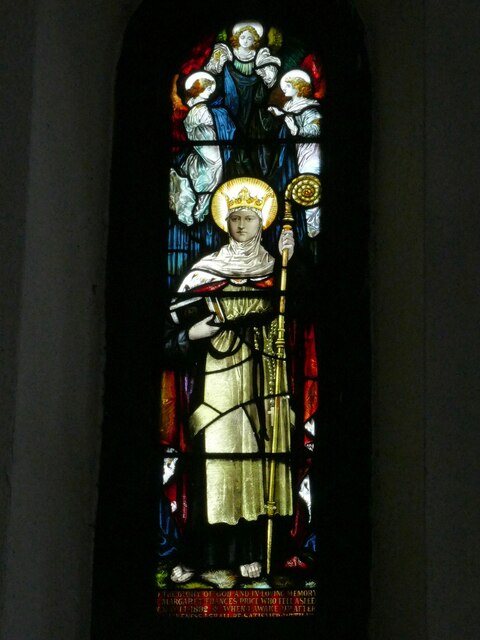
Locate an element on the screen. This screenshot has width=480, height=640. stained glass is located at coordinates (247, 84), (244, 212), (239, 408), (230, 541).